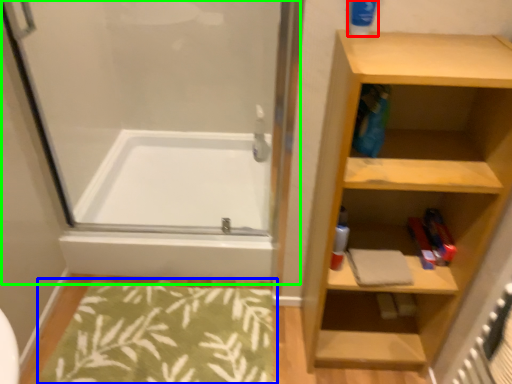
Question: Which is nearer to the cleaning product (highlighted by a red box)? bath mat (highlighted by a blue box) or screen door (highlighted by a green box).

Choices:
 (A) bath mat
 (B) screen door

Answer: (B)